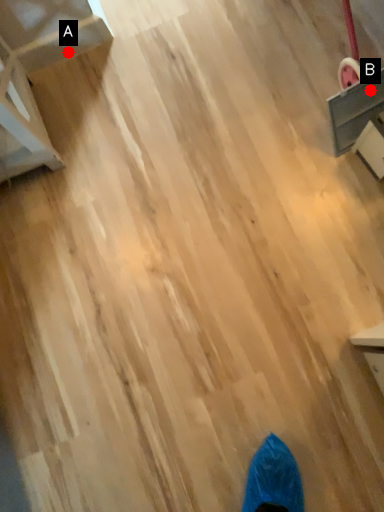
Question: Two points are circled on the image, labeled by A and B beside each circle. Which of the following is the closest to the observer?

Choices:
 (A) A is closer
 (B) B is closer

Answer: (B)